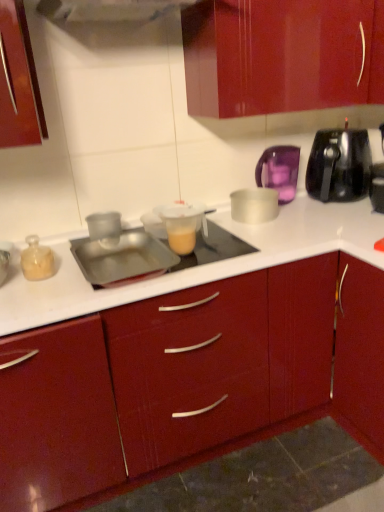
Locate an element on the screen. vacant space to the right of metallic silver tray at center, marked as the 1th appliance in a left-to-right arrangement is located at coordinates (220, 252).